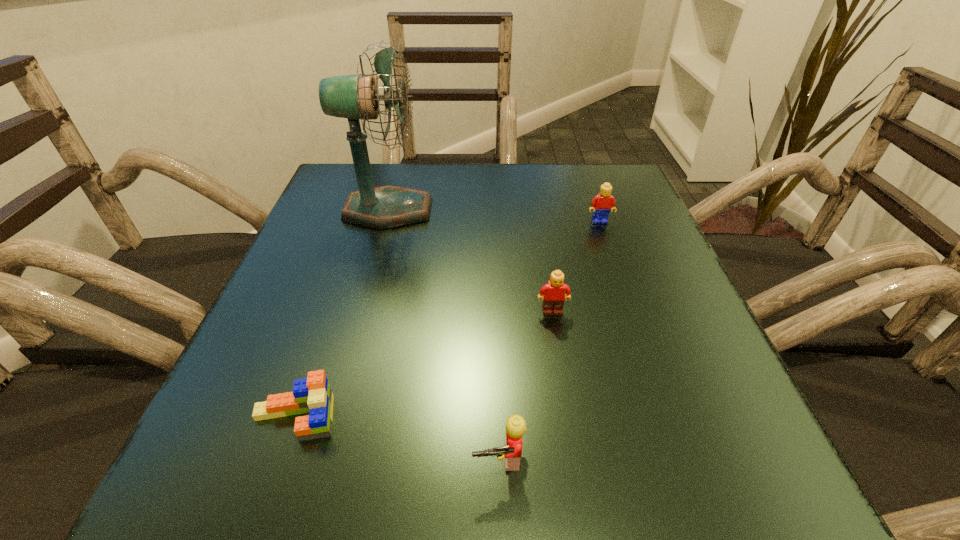
Locate an element on the screen. vacant space that is in between the shortest object and the rightmost Lego is located at coordinates (447, 320).

What are the coordinates of `free point between the shortest Lego and the third Lego from left to right` in the screenshot? It's located at (423, 364).

Locate an element on the screen. This screenshot has width=960, height=540. vacant area that lies between the third object from left to right and the tallest object is located at coordinates (444, 334).

The height and width of the screenshot is (540, 960). Find the location of `free space between the fan and the shortest Lego`. free space between the fan and the shortest Lego is located at coordinates (342, 314).

Find the location of a particular element. The width and height of the screenshot is (960, 540). vacant space that is in between the leftmost Lego and the farthest Lego is located at coordinates (447, 320).

Find the location of `free space between the rightmost object and the third Lego from right to left`. free space between the rightmost object and the third Lego from right to left is located at coordinates (549, 340).

What are the coordinates of `object that can be found as the fourth closest to the third Lego from right to left` in the screenshot? It's located at (601, 204).

You are a GUI agent. You are given a task and a screenshot of the screen. Output one action in this format:
    pyautogui.click(x=<x>, y=<y>)
    Task: Click on the object identified as the closest to the rightmost Lego
    The width and height of the screenshot is (960, 540).
    Given the screenshot: What is the action you would take?
    pyautogui.click(x=554, y=296)

Find the location of a particular element. This screenshot has height=540, width=960. the closest Lego to the rightmost Lego is located at coordinates (554, 296).

Identify which Lego is the closest to the rightmost object. Please provide its 2D coordinates. Your answer should be formatted as a tuple, i.e. [(x, y)], where the tuple contains the x and y coordinates of a point satisfying the conditions above.

[(554, 296)]